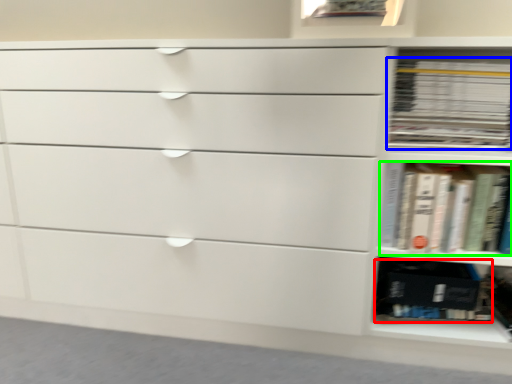
Question: Estimate the real-world distances between objects in this image. Which object is farther from paperback book (highlighted by a red box), book (highlighted by a blue box) or book (highlighted by a green box)?

Choices:
 (A) book
 (B) book

Answer: (A)